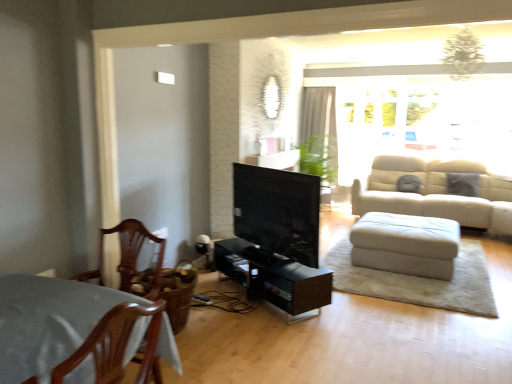
Question: Is white leather footrest at lower right located within white sheer curtain at upper center?

Choices:
 (A) no
 (B) yes

Answer: (A)

Question: Considering the relative sizes of white sheer curtain at upper center and white leather footrest at lower right in the image provided, is white sheer curtain at upper center taller than white leather footrest at lower right?

Choices:
 (A) no
 (B) yes

Answer: (B)

Question: From a real-world perspective, is white sheer curtain at upper center beneath white leather footrest at lower right?

Choices:
 (A) no
 (B) yes

Answer: (A)

Question: From the image's perspective, is white sheer curtain at upper center on white leather footrest at lower right?

Choices:
 (A) yes
 (B) no

Answer: (A)

Question: Is the position of white sheer curtain at upper center less distant than that of white leather footrest at lower right?

Choices:
 (A) no
 (B) yes

Answer: (A)

Question: Is white sheer curtain at upper center wider or thinner than matte black tv at center?

Choices:
 (A) wide
 (B) thin

Answer: (A)

Question: In terms of size, does white sheer curtain at upper center appear bigger or smaller than matte black tv at center?

Choices:
 (A) big
 (B) small

Answer: (A)

Question: Is point (306, 102) closer or farther from the camera than point (291, 241)?

Choices:
 (A) farther
 (B) closer

Answer: (A)

Question: Based on their positions, is white sheer curtain at upper center located to the left or right of matte black tv at center?

Choices:
 (A) right
 (B) left

Answer: (A)

Question: Is translucent glass window at upper right inside or outside of matte black tv at center?

Choices:
 (A) outside
 (B) inside

Answer: (A)

Question: Does point (353, 130) appear closer or farther from the camera than point (281, 226)?

Choices:
 (A) farther
 (B) closer

Answer: (A)

Question: Is translucent glass window at upper right bigger or smaller than matte black tv at center?

Choices:
 (A) small
 (B) big

Answer: (B)

Question: Visually, is translucent glass window at upper right positioned to the left or to the right of matte black tv at center?

Choices:
 (A) left
 (B) right

Answer: (B)

Question: In the image, is matte black tv at center positioned in front of or behind white sheer curtain at upper center?

Choices:
 (A) behind
 (B) front

Answer: (B)

Question: From the image's perspective, is matte black tv at center positioned above or below white sheer curtain at upper center?

Choices:
 (A) above
 (B) below

Answer: (B)